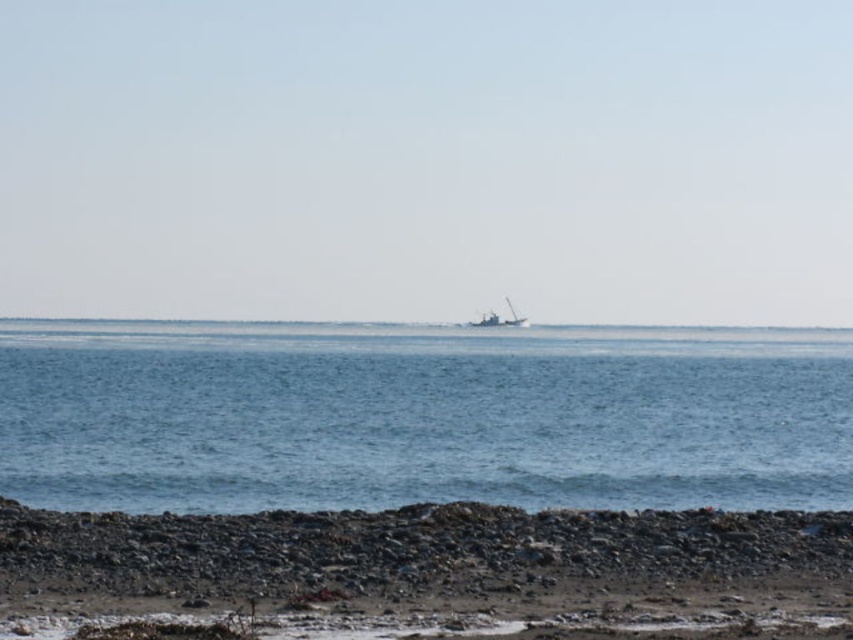
Question: Which object is the closest to the blue water at center?

Choices:
 (A) rough textured rocks at lower center
 (B) metallic gray boat at center

Answer: (B)

Question: Does blue water at center appear under metallic gray boat at center?

Choices:
 (A) no
 (B) yes

Answer: (B)

Question: Can you confirm if rough textured rocks at lower center is positioned below metallic gray boat at center?

Choices:
 (A) yes
 (B) no

Answer: (A)

Question: Estimate the real-world distances between objects in this image. Which object is farther from the metallic gray boat at center?

Choices:
 (A) blue water at center
 (B) rough textured rocks at lower center

Answer: (B)

Question: Is rough textured rocks at lower center wider than metallic gray boat at center?

Choices:
 (A) yes
 (B) no

Answer: (B)

Question: Which is farther from the blue water at center?

Choices:
 (A) metallic gray boat at center
 (B) rough textured rocks at lower center

Answer: (B)